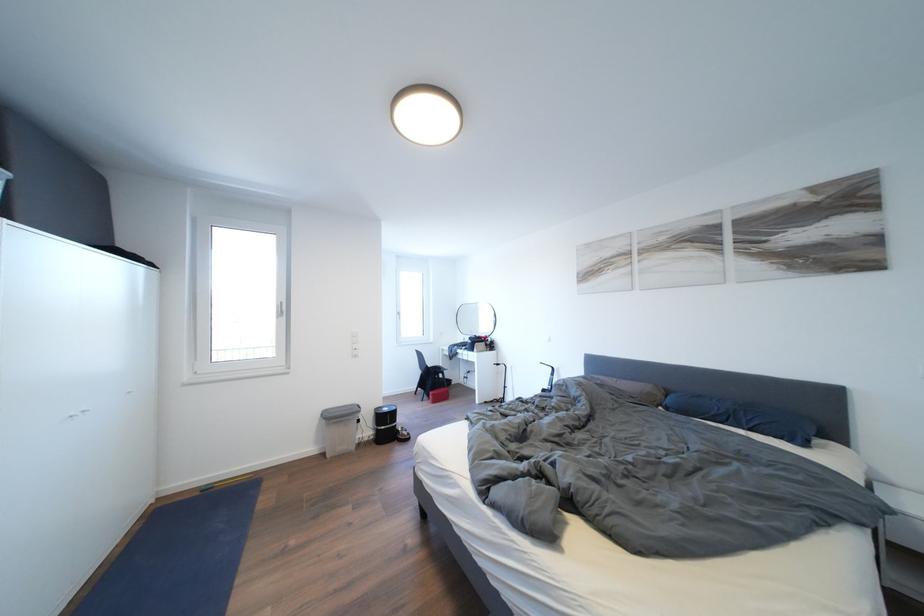
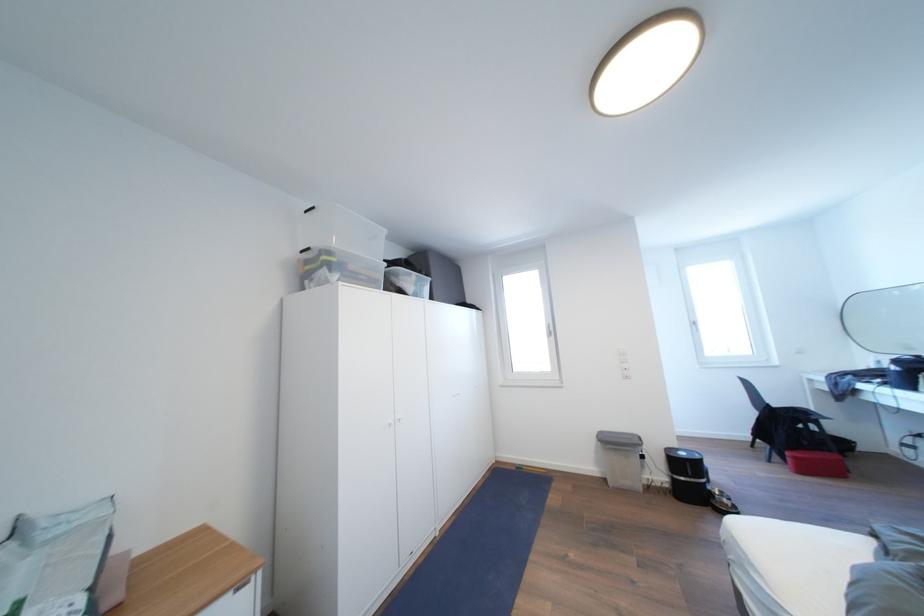
Question: How did the camera likely rotate?

Choices:
 (A) Left
 (B) Right
 (C) Up
 (D) Down

Answer: (A)